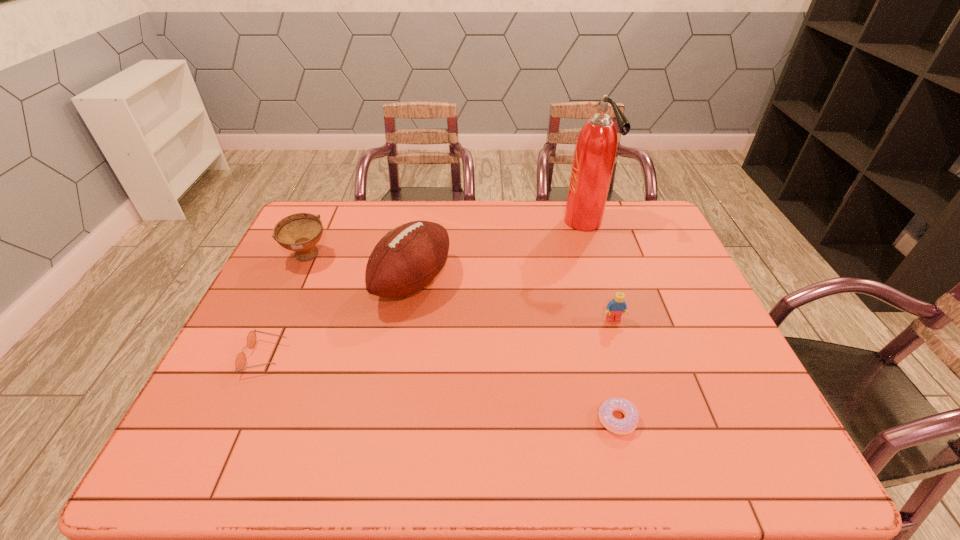
Where is `vacant point located between the fifth tallest object and the soup bowl`? vacant point located between the fifth tallest object and the soup bowl is located at coordinates (286, 307).

Locate an element on the screen. The image size is (960, 540). free point between the second nearest object and the soup bowl is located at coordinates (286, 307).

What are the coordinates of `vacant area that lies between the fifth shortest object and the spectacles` in the screenshot? It's located at (339, 319).

Image resolution: width=960 pixels, height=540 pixels. Identify the location of empty space that is in between the farthest object and the doughnut. (600, 321).

Where is `object that is the third closest one to the second nearest object`? The image size is (960, 540). object that is the third closest one to the second nearest object is located at coordinates (627, 425).

Identify which object is located as the second nearest to the nearest object. Please provide its 2D coordinates. Your answer should be formatted as a tuple, i.e. [(x, y)], where the tuple contains the x and y coordinates of a point satisfying the conditions above.

[(407, 259)]

This screenshot has width=960, height=540. In order to click on free location that satisfies the following two spatial constraints: 1. on the front-facing side of the second nearest object; 2. on the left side of the shortest object in this screenshot , I will do `click(237, 419)`.

In order to click on vacant space that satisfies the following two spatial constraints: 1. on the front side of the soup bowl; 2. on the right side of the second tallest object in this screenshot , I will do `click(296, 282)`.

Locate an element on the screen. The width and height of the screenshot is (960, 540). vacant space that satisfies the following two spatial constraints: 1. on the face of the Lego; 2. on the front-facing side of the second nearest object is located at coordinates click(625, 356).

Find the location of a particular element. This screenshot has height=540, width=960. free region that satisfies the following two spatial constraints: 1. on the back side of the fire extinguisher; 2. on the left side of the shortest object is located at coordinates (567, 222).